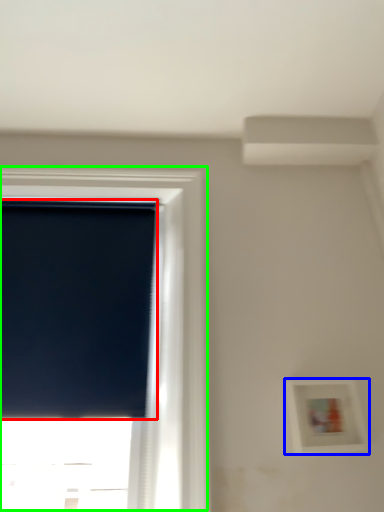
Question: Estimate the real-world distances between objects in this image. Which object is closer to window screen (highlighted by a red box), picture frame (highlighted by a blue box) or window (highlighted by a green box)?

Choices:
 (A) picture frame
 (B) window

Answer: (B)